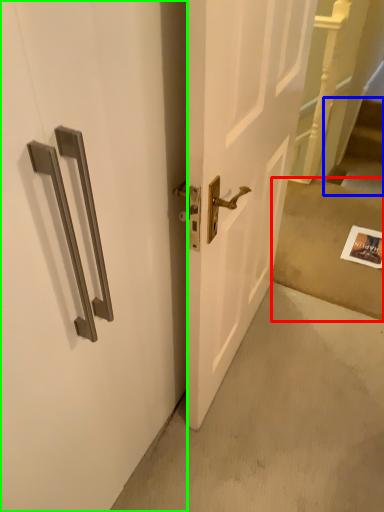
Question: Based on their relative distances, which object is farther from concrete (highlighted by a red box)? Choose from stairwell (highlighted by a blue box) and door (highlighted by a green box).

Choices:
 (A) stairwell
 (B) door

Answer: (B)